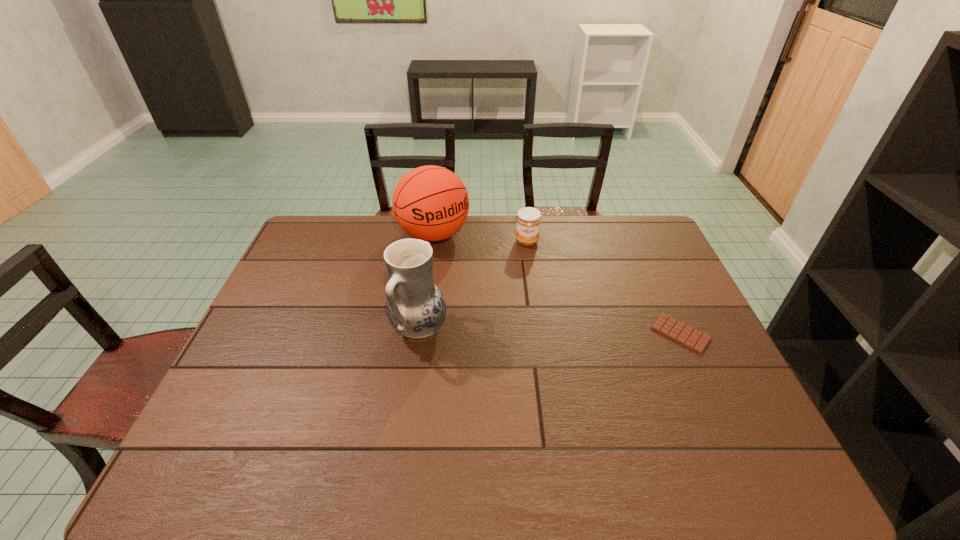
In the image, there is a desktop. At what (x,y) coordinates should I click in order to perform the action: click on vacant space at the far left corner. Please return your answer as a coordinate pair (x, y). The width and height of the screenshot is (960, 540). Looking at the image, I should click on (331, 239).

Locate an element on the screen. This screenshot has height=540, width=960. free space at the near left corner of the desktop is located at coordinates (230, 417).

At what (x,y) coordinates should I click in order to perform the action: click on free space between the rightmost object and the basketball. Please return your answer as a coordinate pair (x, y). Looking at the image, I should click on (557, 284).

This screenshot has width=960, height=540. I want to click on free space between the candy bar and the second shortest object, so click(604, 287).

Find the location of a particular element. vacant space that is in between the basketball and the second object from right to left is located at coordinates (480, 238).

Locate an element on the screen. vacant space in between the shortest object and the pottery is located at coordinates (550, 331).

Find the location of a particular element. Image resolution: width=960 pixels, height=540 pixels. empty space that is in between the basketball and the candy bar is located at coordinates (557, 284).

You are a GUI agent. You are given a task and a screenshot of the screen. Output one action in this format:
    pyautogui.click(x=<x>, y=<y>)
    Task: Click on the vacant region between the pottery and the second object from right to left
    
    Given the screenshot: What is the action you would take?
    pyautogui.click(x=473, y=285)

I want to click on vacant area that lies between the pottery and the second object from right to left, so click(x=473, y=285).

Identify the location of free space between the jam and the pottery. (473, 285).